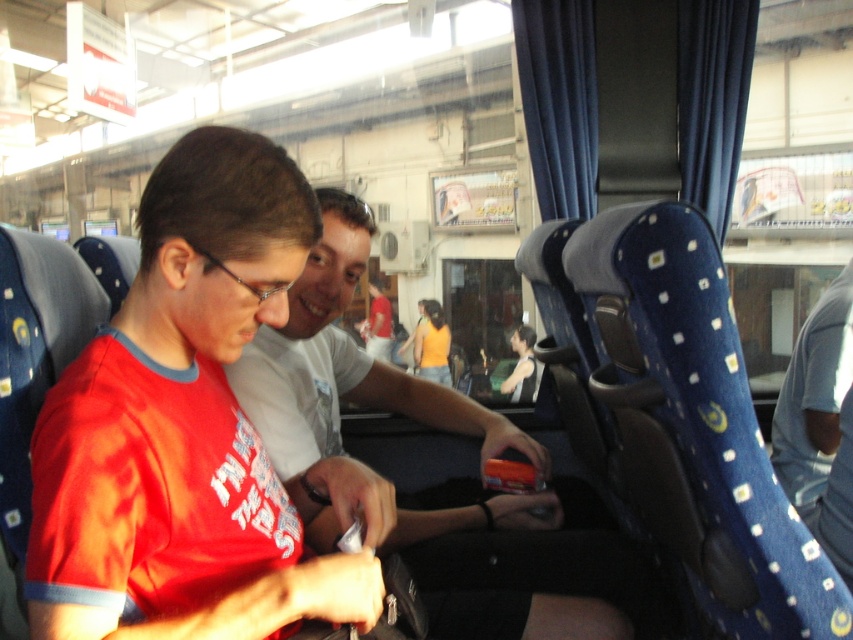
Between orange fabric top at center and matte black hair at center, which one appears on the right side from the viewer's perspective?

From the viewer's perspective, matte black hair at center appears more on the right side.

Is orange fabric top at center bigger than matte black hair at center?

Yes, orange fabric top at center is bigger than matte black hair at center.

Where is `orange fabric top at center`? orange fabric top at center is located at coordinates (431, 342).

Is matte black hair at center positioned in front of matte white shirt at center?

Yes, it is.

Is matte black hair at center taller than matte white shirt at center?

No, matte black hair at center is not taller than matte white shirt at center.

Which is in front, point (508, 388) or point (380, 321)?

Positioned in front is point (508, 388).

The image size is (853, 640). Find the location of `matte black hair at center`. matte black hair at center is located at coordinates (521, 368).

Does blue denim jeans at lower right appear on the left side of orange fabric top at center?

Incorrect, blue denim jeans at lower right is not on the left side of orange fabric top at center.

Which of these two, blue denim jeans at lower right or orange fabric top at center, stands shorter?

Standing shorter between the two is blue denim jeans at lower right.

Is point (814, 422) farther from viewer compared to point (427, 337)?

No.

I want to click on blue denim jeans at lower right, so click(814, 394).